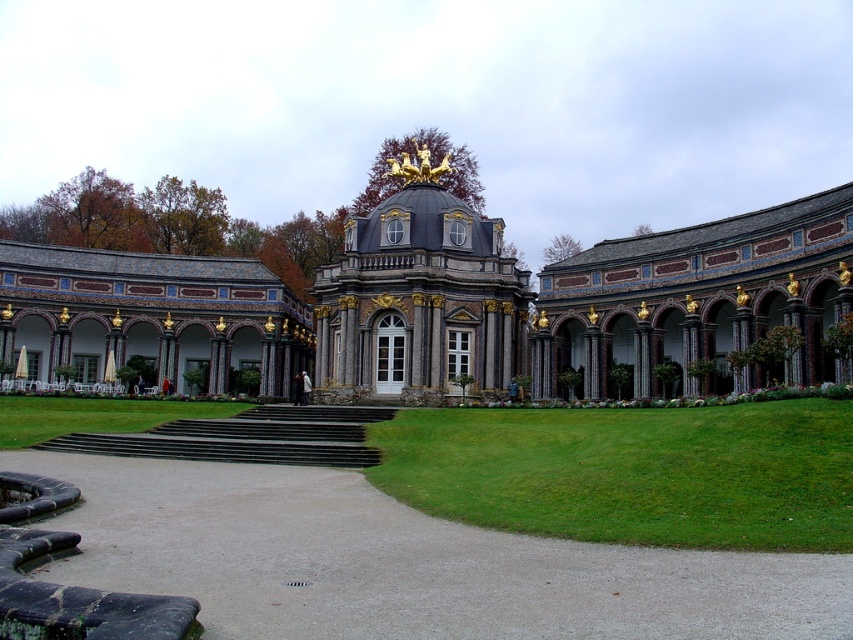
Looking at this image, between polished stone palace at center and green grass at center, which one has more height?

polished stone palace at center

Does polished stone palace at center have a lesser width compared to green grass at center?

No, polished stone palace at center is not thinner than green grass at center.

Describe the element at coordinates (454, 305) in the screenshot. The height and width of the screenshot is (640, 853). I see `polished stone palace at center` at that location.

The image size is (853, 640). In order to click on polished stone palace at center in this screenshot , I will do `click(454, 305)`.

Is polished stone dome at center above green grass at center?

Yes, polished stone dome at center is above green grass at center.

Is point (422, 321) positioned behind point (67, 426)?

Yes, point (422, 321) is behind point (67, 426).

Which is behind, point (422, 296) or point (135, 413)?

Point (422, 296)

This screenshot has width=853, height=640. In order to click on polished stone dome at center in this screenshot , I will do `click(419, 296)`.

Is dark gray stone colonnade at right wider than matte stone patio at lower left?

No, dark gray stone colonnade at right is not wider than matte stone patio at lower left.

Does dark gray stone colonnade at right have a lesser height compared to matte stone patio at lower left?

Incorrect, dark gray stone colonnade at right's height does not fall short of matte stone patio at lower left's.

Which is in front, point (630, 312) or point (216, 368)?

Point (630, 312)

Where is `dark gray stone colonnade at right`? Image resolution: width=853 pixels, height=640 pixels. dark gray stone colonnade at right is located at coordinates (701, 301).